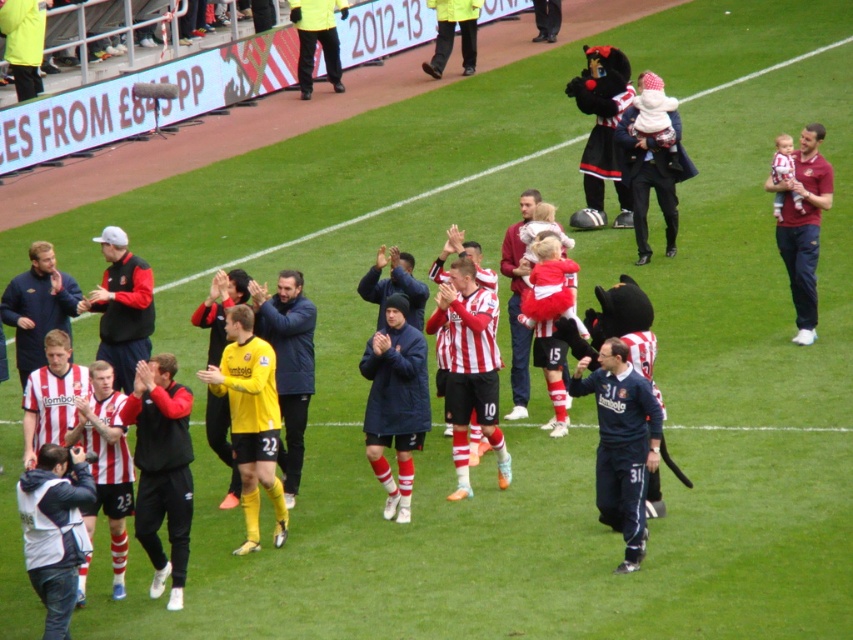
You are a photographer standing at the edge of the football pitch. You need to take a photo that includes both the dark blue jersey at center and the maroon jersey at right. Based on their positions, which jersey should you focus on first to ensure both are in the frame?

The dark blue jersey at center is located below the maroon jersey at right, so you should focus on the maroon jersey at right first to ensure both are in the frame.

You are a photographer at the football stadium. You need to capture a photo where the blue jacket at center and the yellow jersey at center are both visible. Based on their positions, which one should you focus on first to ensure both are in frame?

The blue jacket at center is below the yellow jersey at center, so you should focus on the yellow jersey at center first to ensure both are in frame.